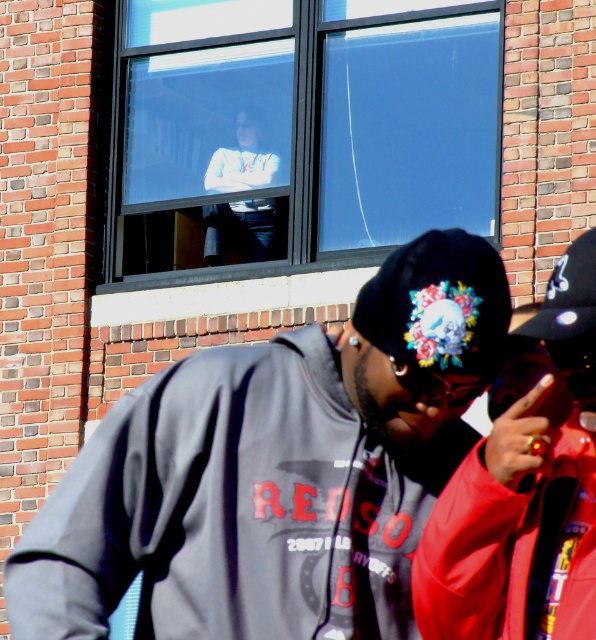
You are standing outside the brick building and want to know how far you are from the point marked at coordinates (277, 609). Can you determine the distance?

The point marked at coordinates (277, 609) is 59.07 feet away from you.